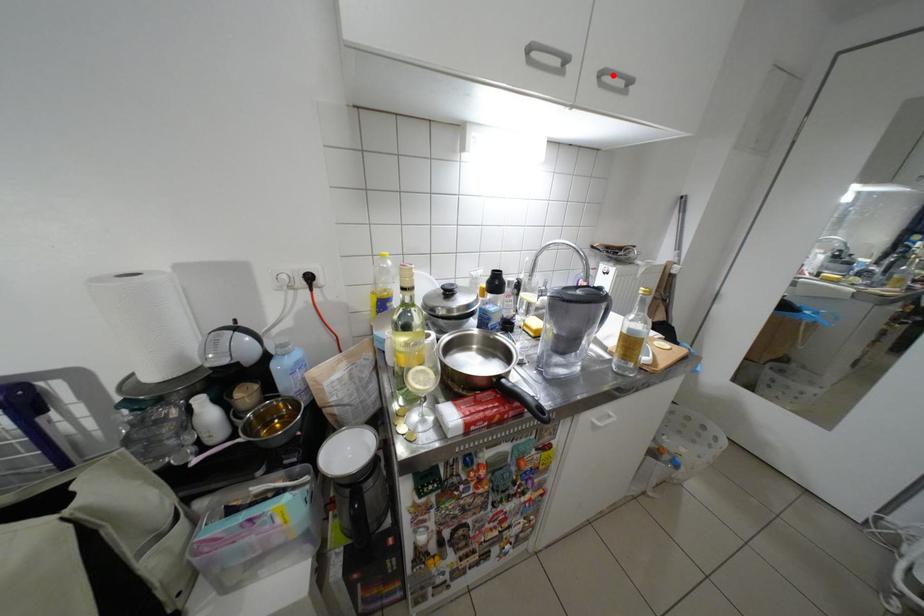
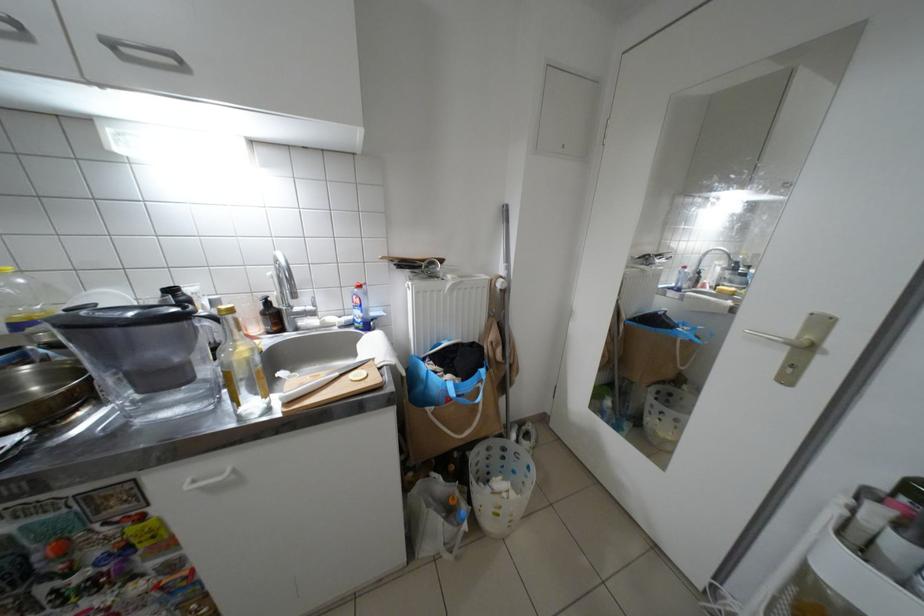
The point at the highlighted location is marked in the first image. Where is the corresponding point in the second image?

(123, 46)